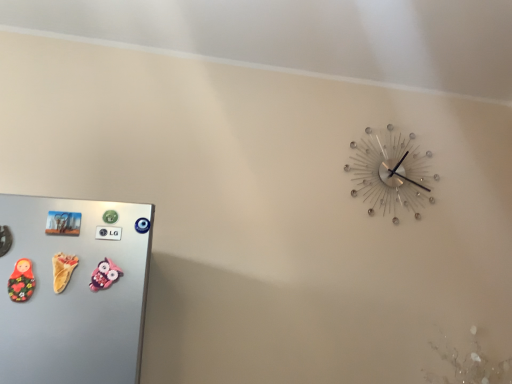
Question: Is yellow rubber duck at left, marked as the second toy in a left-to-right arrangement, oriented towards matte wooden doll at left, which is counted as the first toy, starting from the left?

Choices:
 (A) yes
 (B) no

Answer: (B)

Question: From a real-world perspective, is yellow rubber duck at left, marked as the second toy in a left-to-right arrangement, positioned over matte wooden doll at left, which is counted as the first toy, starting from the left, based on gravity?

Choices:
 (A) yes
 (B) no

Answer: (A)

Question: Does yellow rubber duck at left, which is the 2th toy in right-to-left order, appear on the right side of matte wooden doll at left, which is counted as the first toy, starting from the left?

Choices:
 (A) no
 (B) yes

Answer: (B)

Question: Does yellow rubber duck at left, which is the 2th toy in right-to-left order, have a larger size compared to matte wooden doll at left, which ranks as the third toy in right-to-left order?

Choices:
 (A) no
 (B) yes

Answer: (B)

Question: Is yellow rubber duck at left, marked as the second toy in a left-to-right arrangement, shorter than matte wooden doll at left, which ranks as the third toy in right-to-left order?

Choices:
 (A) no
 (B) yes

Answer: (B)

Question: Considering the relative sizes of yellow rubber duck at left, marked as the second toy in a left-to-right arrangement, and matte wooden doll at left, which is counted as the first toy, starting from the left, in the image provided, is yellow rubber duck at left, marked as the second toy in a left-to-right arrangement, thinner than matte wooden doll at left, which is counted as the first toy, starting from the left,?

Choices:
 (A) yes
 (B) no

Answer: (B)

Question: From a real-world perspective, does pink fabric owl at lower left, which is the 3th toy in left-to-right order, stand above matte wooden doll at left, which is counted as the first toy, starting from the left?

Choices:
 (A) no
 (B) yes

Answer: (B)

Question: From the image's perspective, is pink fabric owl at lower left, which is the 3th toy in left-to-right order, on top of matte wooden doll at left, which ranks as the third toy in right-to-left order?

Choices:
 (A) yes
 (B) no

Answer: (A)

Question: Considering the relative sizes of pink fabric owl at lower left, which is the 3th toy in left-to-right order, and matte wooden doll at left, which ranks as the third toy in right-to-left order, in the image provided, is pink fabric owl at lower left, which is the 3th toy in left-to-right order, taller than matte wooden doll at left, which ranks as the third toy in right-to-left order,?

Choices:
 (A) no
 (B) yes

Answer: (A)

Question: Can you confirm if pink fabric owl at lower left, which is the 3th toy in left-to-right order, is shorter than matte wooden doll at left, which ranks as the third toy in right-to-left order?

Choices:
 (A) yes
 (B) no

Answer: (A)

Question: From a real-world perspective, is pink fabric owl at lower left, which is the 3th toy in left-to-right order, physically below matte wooden doll at left, which ranks as the third toy in right-to-left order?

Choices:
 (A) no
 (B) yes

Answer: (A)

Question: Is pink fabric owl at lower left, the 1th toy in the right-to-left sequence, bigger than matte wooden doll at left, which ranks as the third toy in right-to-left order?

Choices:
 (A) no
 (B) yes

Answer: (A)

Question: From the image's perspective, is matte wooden doll at left, which ranks as the third toy in right-to-left order, above pink fabric owl at lower left, which is the 3th toy in left-to-right order?

Choices:
 (A) yes
 (B) no

Answer: (B)